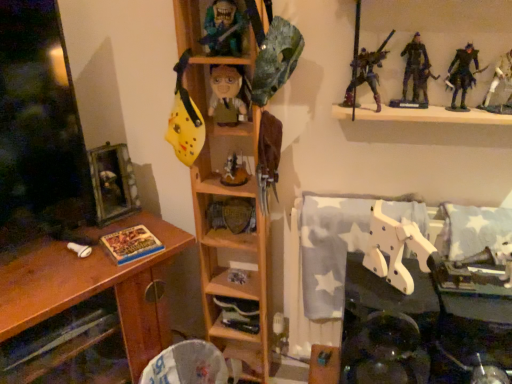
Where is `vacant space to the right of white wood robot at lower right, arranged as the fifth toy when viewed from the top`? This screenshot has width=512, height=384. vacant space to the right of white wood robot at lower right, arranged as the fifth toy when viewed from the top is located at coordinates (466, 285).